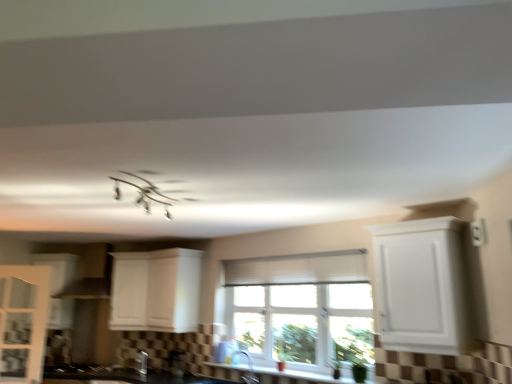
Question: In which direction should I rotate to look at white matte cabinet at center, which appears as the 3th cabinetry when viewed from the right?

Choices:
 (A) left
 (B) right

Answer: (A)

Question: From the image's perspective, does black matte gas stove at lower left appear higher than white glossy cabinet at left, which is the fifth cabinetry in right-to-left order?

Choices:
 (A) yes
 (B) no

Answer: (B)

Question: From a real-world perspective, is black matte gas stove at lower left located beneath white glossy cabinet at left, which is the fifth cabinetry in right-to-left order?

Choices:
 (A) no
 (B) yes

Answer: (B)

Question: Is white glossy cabinet at left, the 1th cabinetry when ordered from left to right, surrounded by black matte gas stove at lower left?

Choices:
 (A) yes
 (B) no

Answer: (B)

Question: Is black matte gas stove at lower left positioned before white glossy cabinet at left, which is the fifth cabinetry in right-to-left order?

Choices:
 (A) yes
 (B) no

Answer: (A)

Question: Is black matte gas stove at lower left not close to white glossy cabinet at left, which is the fifth cabinetry in right-to-left order?

Choices:
 (A) no
 (B) yes

Answer: (A)

Question: From the image's perspective, does black matte gas stove at lower left appear lower than white glossy cabinet at left, the 1th cabinetry when ordered from left to right?

Choices:
 (A) no
 (B) yes

Answer: (B)

Question: Does satin nickel faucet at lower center have a smaller size compared to white matte cabinet at center, arranged as the 2th cabinetry when viewed from the right?

Choices:
 (A) yes
 (B) no

Answer: (A)

Question: Can you confirm if satin nickel faucet at lower center is bigger than white matte cabinet at center, the fourth cabinetry from the left?

Choices:
 (A) yes
 (B) no

Answer: (B)

Question: Considering the relative sizes of satin nickel faucet at lower center and white matte cabinet at center, the fourth cabinetry from the left, in the image provided, is satin nickel faucet at lower center thinner than white matte cabinet at center, the fourth cabinetry from the left,?

Choices:
 (A) no
 (B) yes

Answer: (B)

Question: Does satin nickel faucet at lower center lie behind white matte cabinet at center, the fourth cabinetry from the left?

Choices:
 (A) yes
 (B) no

Answer: (B)

Question: From the image's perspective, would you say satin nickel faucet at lower center is positioned over white matte cabinet at center, arranged as the 2th cabinetry when viewed from the right?

Choices:
 (A) yes
 (B) no

Answer: (B)

Question: Is satin nickel faucet at lower center shorter than white matte cabinet at center, arranged as the 2th cabinetry when viewed from the right?

Choices:
 (A) no
 (B) yes

Answer: (B)

Question: Can you confirm if white matte cabinet at center, which appears as the 3th cabinetry when viewed from the right, is positioned to the right of black matte gas stove at lower left?

Choices:
 (A) no
 (B) yes

Answer: (B)